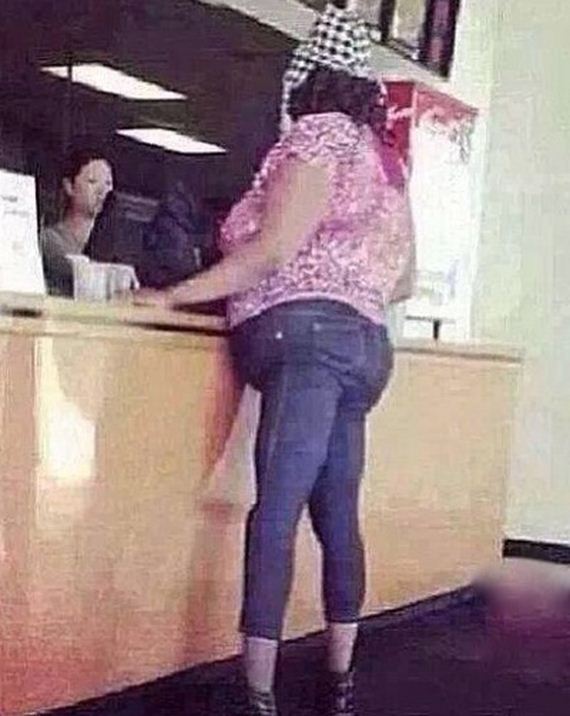
Where is `wall`? wall is located at coordinates (528, 190).